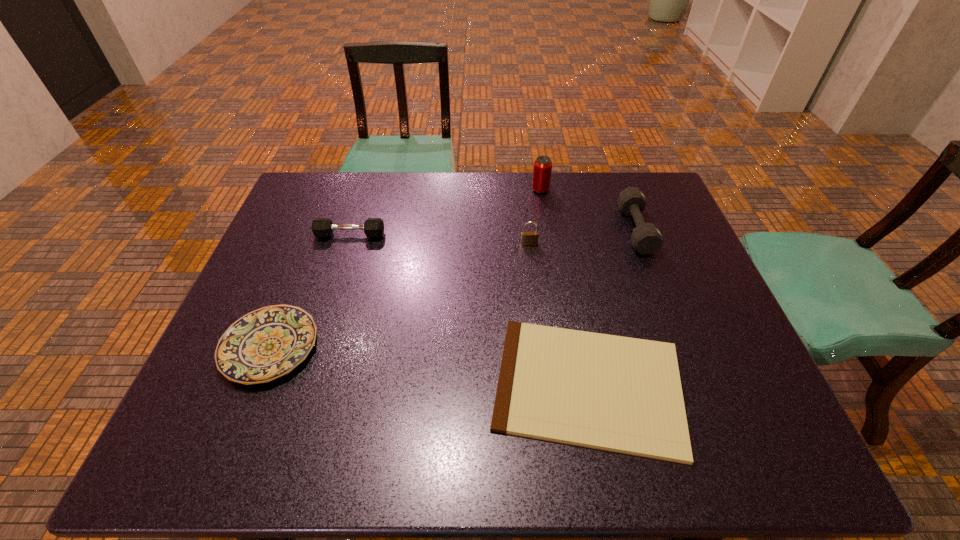
The height and width of the screenshot is (540, 960). Find the location of `the farthest object`. the farthest object is located at coordinates (542, 170).

Locate an element on the screen. Image resolution: width=960 pixels, height=540 pixels. the tallest object is located at coordinates (542, 170).

At what (x,y) coordinates should I click in order to perform the action: click on padlock. Please return your answer as a coordinate pair (x, y). Looking at the image, I should click on (527, 238).

Locate an element on the screen. the right dumbbell is located at coordinates (646, 238).

Locate an element on the screen. This screenshot has height=540, width=960. the left dumbbell is located at coordinates (321, 227).

The height and width of the screenshot is (540, 960). I want to click on the fourth tallest object, so click(321, 227).

Find the location of a particular element. The width and height of the screenshot is (960, 540). plate is located at coordinates (265, 344).

Where is `the shortest object`? This screenshot has width=960, height=540. the shortest object is located at coordinates point(620,394).

Locate an element on the screen. The width and height of the screenshot is (960, 540). free spot located 0.350m on the front of the can is located at coordinates (554, 271).

Identify the location of vacant region located 0.290m on the front-facing side of the padlock. The width and height of the screenshot is (960, 540). (539, 326).